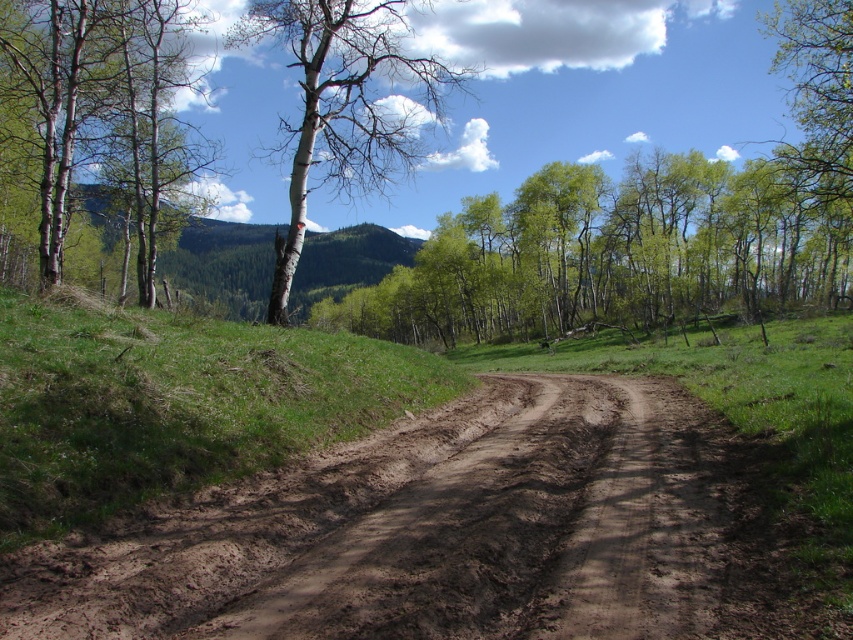
Who is shorter, green leafy tree at center or smooth white tree at left?

With less height is green leafy tree at center.

Is green leafy tree at center thinner than smooth white tree at left?

No, green leafy tree at center is not thinner than smooth white tree at left.

The height and width of the screenshot is (640, 853). Identify the location of green leafy tree at center. (616, 253).

Can you confirm if brown muddy road at center is bigger than green grassy hillside at left?

Incorrect, brown muddy road at center is not larger than green grassy hillside at left.

Is point (671, 532) positioned behind point (178, 324)?

No, it is not.

Find the location of `brown muddy road at center`. brown muddy road at center is located at coordinates (451, 532).

Can you confirm if white bark tree at upper center is thinner than green leafy tree at upper right?

Correct, white bark tree at upper center's width is less than green leafy tree at upper right's.

Based on the photo, is white bark tree at upper center taller than green leafy tree at upper right?

Indeed, white bark tree at upper center has a greater height compared to green leafy tree at upper right.

Locate an element on the screen. This screenshot has width=853, height=640. white bark tree at upper center is located at coordinates (345, 104).

At what (x,y) coordinates should I click in order to perform the action: click on white bark tree at upper center. Please return your answer as a coordinate pair (x, y). Looking at the image, I should click on (345, 104).